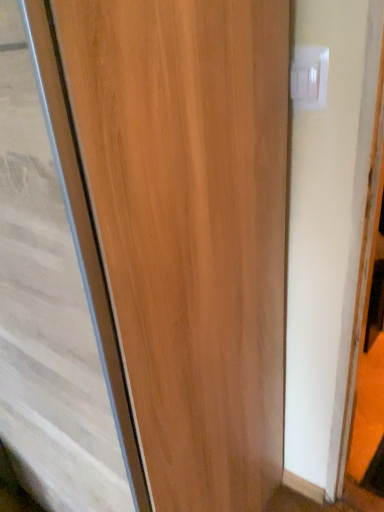
Question: Does point (162, 223) appear closer or farther from the camera than point (312, 81)?

Choices:
 (A) farther
 (B) closer

Answer: (B)

Question: Is wooden door at center in front of or behind white plastic electric outlet at upper right in the image?

Choices:
 (A) front
 (B) behind

Answer: (A)

Question: Is wooden door at center inside the boundaries of white plastic electric outlet at upper right, or outside?

Choices:
 (A) outside
 (B) inside

Answer: (A)

Question: Based on their positions, is white plastic electric outlet at upper right located to the left or right of wooden door at center?

Choices:
 (A) right
 (B) left

Answer: (A)

Question: From a real-world perspective, is white plastic electric outlet at upper right above or below wooden door at center?

Choices:
 (A) above
 (B) below

Answer: (A)

Question: Is point (307, 61) positioned closer to the camera than point (109, 273)?

Choices:
 (A) farther
 (B) closer

Answer: (A)

Question: Choose the correct answer: Is white plastic electric outlet at upper right inside wooden door at center or outside it?

Choices:
 (A) outside
 (B) inside

Answer: (A)